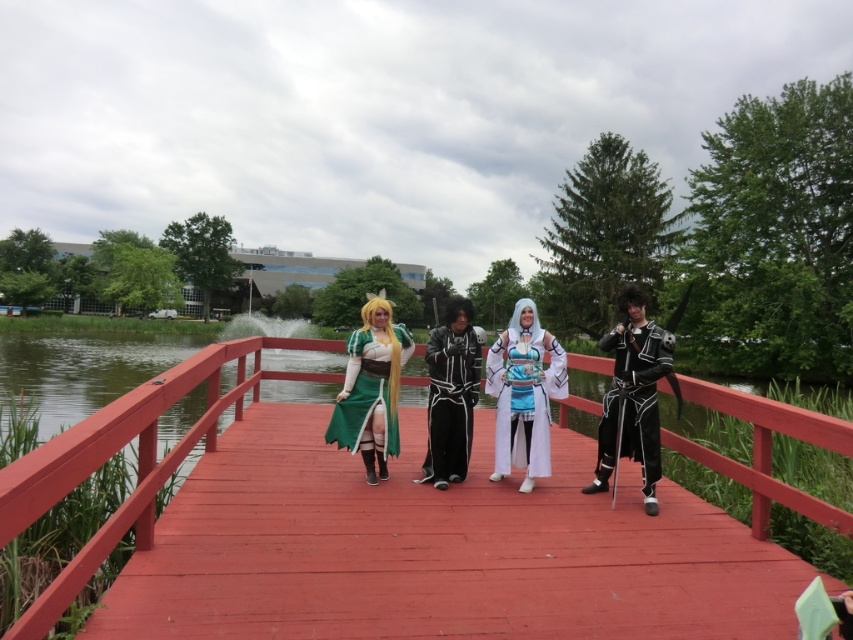
Question: Among these points, which one is farthest from the camera?

Choices:
 (A) (526, 464)
 (B) (360, 387)
 (C) (270, 584)

Answer: (A)

Question: Which point is farther from the camera taking this photo?

Choices:
 (A) coord(256,381)
 (B) coord(428,358)
 (C) coord(389,403)
 (D) coord(618,340)

Answer: (A)

Question: Does wooden bridge at center have a smaller size compared to white glossy kimono at center?

Choices:
 (A) yes
 (B) no

Answer: (A)

Question: Does black leather armor at right have a smaller size compared to green satin dress at center?

Choices:
 (A) yes
 (B) no

Answer: (B)

Question: Can you confirm if black leather armor at right is positioned to the left of black satin robe at center?

Choices:
 (A) yes
 (B) no

Answer: (B)

Question: Based on their relative distances, which object is farther from the white glossy kimono at center?

Choices:
 (A) wooden bridge at center
 (B) black satin robe at center

Answer: (A)